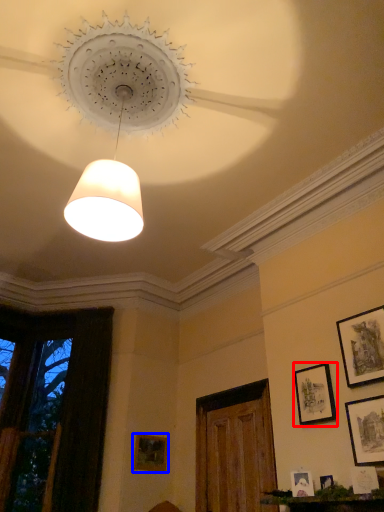
Question: Which object is closer to the camera taking this photo, picture frame (highlighted by a red box) or picture frame (highlighted by a blue box)?

Choices:
 (A) picture frame
 (B) picture frame

Answer: (A)